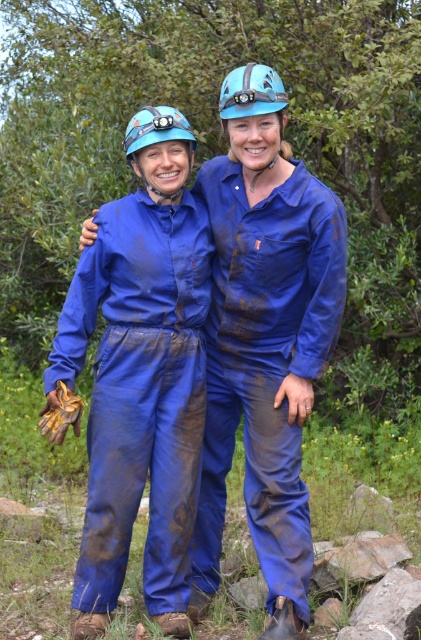
Question: Does blue matte jumpsuit at center lie behind blue matte helmet at upper center?

Choices:
 (A) yes
 (B) no

Answer: (A)

Question: Which point is closer to the camera?

Choices:
 (A) (218, 100)
 (B) (208, 426)
 (C) (148, 184)

Answer: (C)

Question: Among these objects, which one is nearest to the camera?

Choices:
 (A) blue matte jumpsuit at center
 (B) matte blue helmet at center

Answer: (A)

Question: Can you confirm if matte blue helmet at center is positioned to the left of blue matte helmet at upper center?

Choices:
 (A) no
 (B) yes

Answer: (B)

Question: Among these points, which one is farthest from the camera?

Choices:
 (A) (279, 90)
 (B) (172, 134)
 (C) (277, 96)

Answer: (B)

Question: Can you confirm if blue matte helmet at center is positioned above matte blue helmet at center?

Choices:
 (A) yes
 (B) no

Answer: (A)